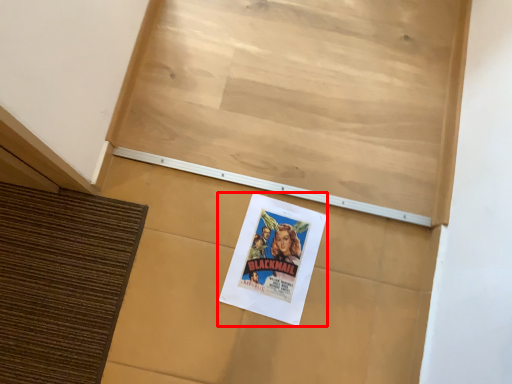
Question: In this image, where is poster (annotated by the red box) located relative to bulletin board?

Choices:
 (A) left
 (B) right

Answer: (B)